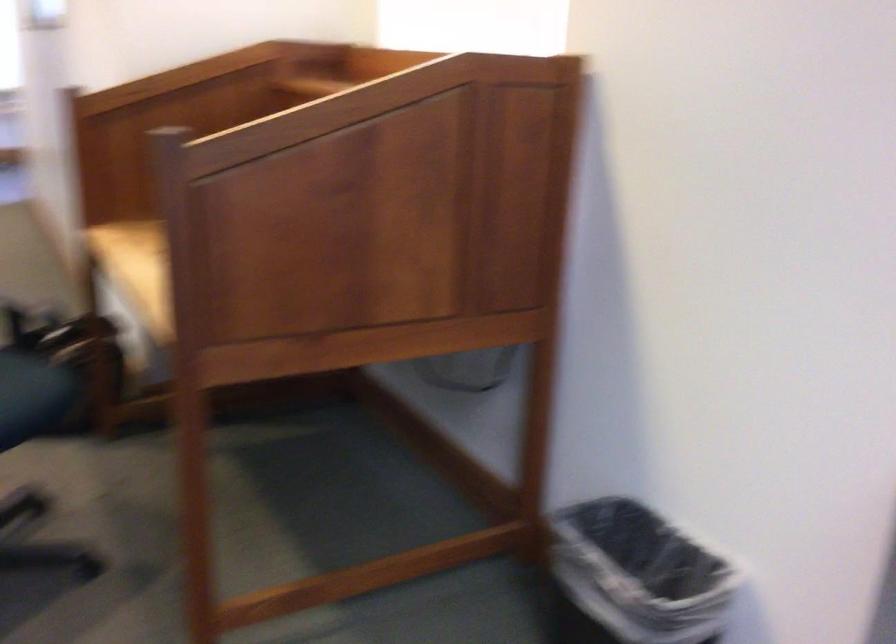
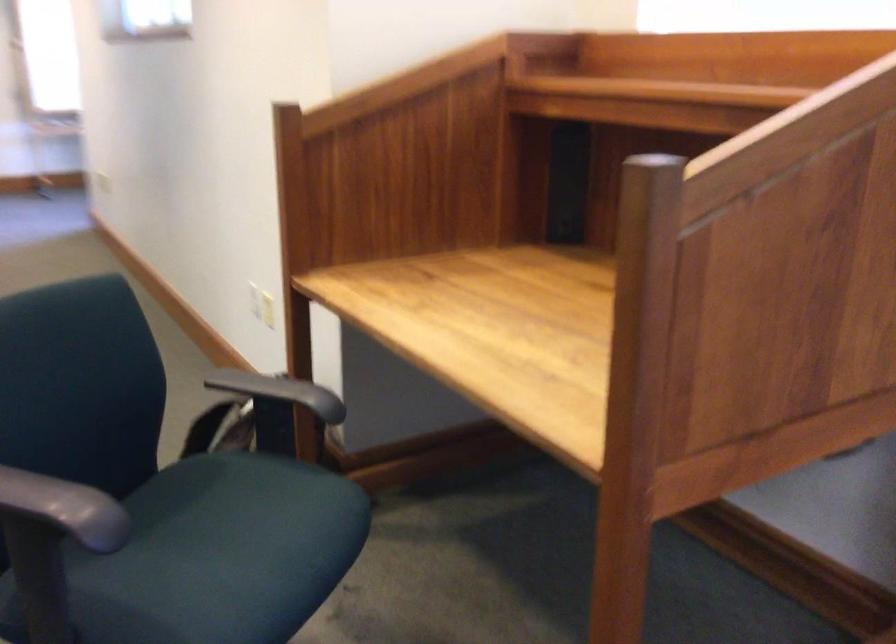
Question: The camera is either moving clockwise (left) or counter-clockwise (right) around the object. The first image is from the beginning of the video and the second image is from the end. Is the camera moving left or right when shooting the video?

Choices:
 (A) Left
 (B) Right

Answer: (B)